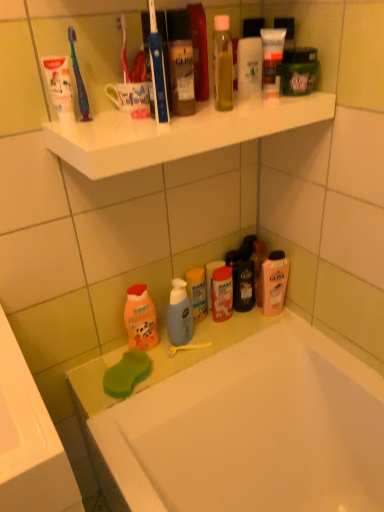
Where is `free point in front of multicolored plastic toothbrush at upper left, the 1th toothbrush in the left-to-right sequence`? The image size is (384, 512). free point in front of multicolored plastic toothbrush at upper left, the 1th toothbrush in the left-to-right sequence is located at coordinates (96, 136).